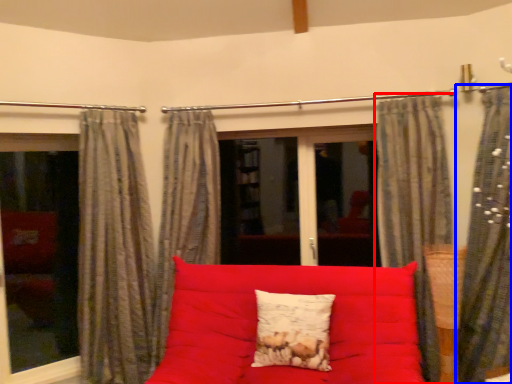
Question: Which point is closer to the camera, curtain (highlighted by a red box) or curtain (highlighted by a blue box)?

Choices:
 (A) curtain
 (B) curtain

Answer: (B)